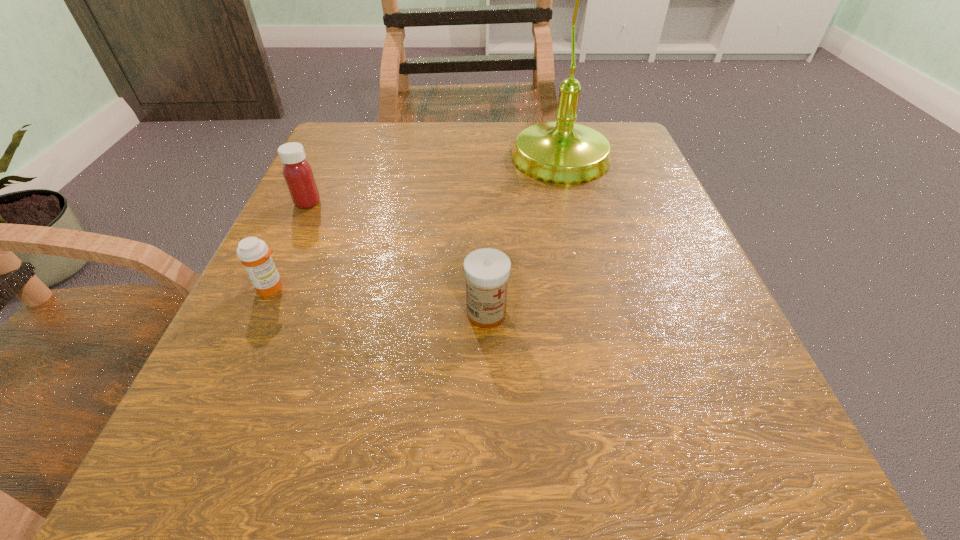
Select which object appears as the third closest to the lamp. Please provide its 2D coordinates. Your answer should be formatted as a tuple, i.e. [(x, y)], where the tuple contains the x and y coordinates of a point satisfying the conditions above.

[(253, 253)]

This screenshot has height=540, width=960. Identify the location of medicine that stands as the closest to the farthest medicine. (253, 253).

At what (x,y) coordinates should I click in order to perform the action: click on the second closest medicine to the nearest object. Please return your answer as a coordinate pair (x, y). This screenshot has height=540, width=960. Looking at the image, I should click on (x=298, y=174).

This screenshot has height=540, width=960. I want to click on free space that satisfies the following two spatial constraints: 1. on the desk next to the tallest object; 2. on the front side of the farthest medicine, so click(572, 202).

Where is `vacant space that satisfies the following two spatial constraints: 1. on the front side of the nearest medicine; 2. on the left side of the second nearest object`? vacant space that satisfies the following two spatial constraints: 1. on the front side of the nearest medicine; 2. on the left side of the second nearest object is located at coordinates (260, 313).

Locate an element on the screen. The image size is (960, 540). vacant space that satisfies the following two spatial constraints: 1. on the front side of the second farthest medicine; 2. on the right side of the rightmost medicine is located at coordinates (260, 313).

Identify the location of blank area in the image that satisfies the following two spatial constraints: 1. on the desk next to the tallest object; 2. on the front side of the rightmost medicine. The image size is (960, 540). (600, 313).